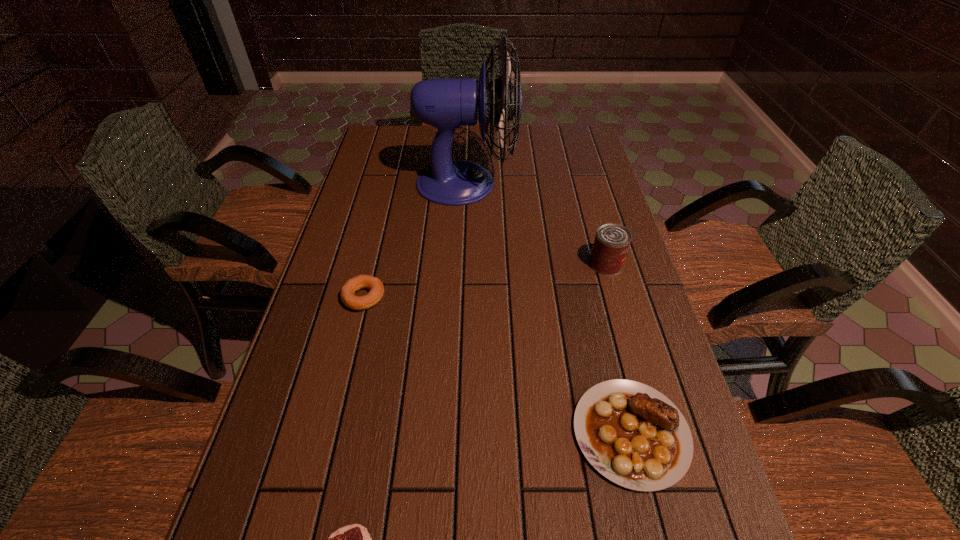
The width and height of the screenshot is (960, 540). Identify the location of fan. (447, 103).

Where is `the tallest object`? Image resolution: width=960 pixels, height=540 pixels. the tallest object is located at coordinates (447, 103).

Where is `the fourth shortest object`? the fourth shortest object is located at coordinates (612, 241).

Where is `the second farthest object`? the second farthest object is located at coordinates (612, 241).

Image resolution: width=960 pixels, height=540 pixels. I want to click on the second nearest object, so click(x=633, y=435).

This screenshot has width=960, height=540. What are the coordinates of `the taller steak` in the screenshot? It's located at (633, 435).

Locate an element on the screen. The width and height of the screenshot is (960, 540). the third farthest object is located at coordinates (356, 283).

Locate an element on the screen. the second shortest object is located at coordinates (356, 283).

This screenshot has width=960, height=540. I want to click on free point located 0.150m in front of the farthest object where the airflow is directed, so click(562, 184).

Find the location of `free space located 0.080m on the left of the fourth shortest object`. free space located 0.080m on the left of the fourth shortest object is located at coordinates (560, 264).